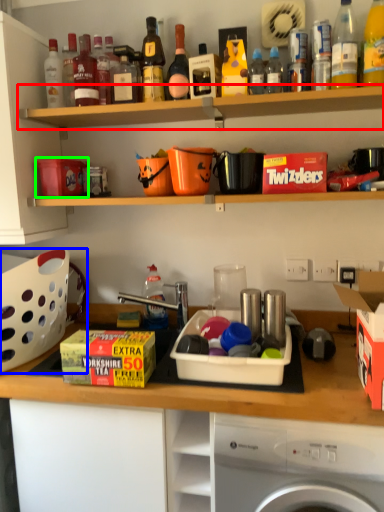
Question: Which object is the closest to the shelf (highlighted by a red box)? Choose among these: basket (highlighted by a blue box) or box (highlighted by a green box).

Choices:
 (A) basket
 (B) box

Answer: (B)